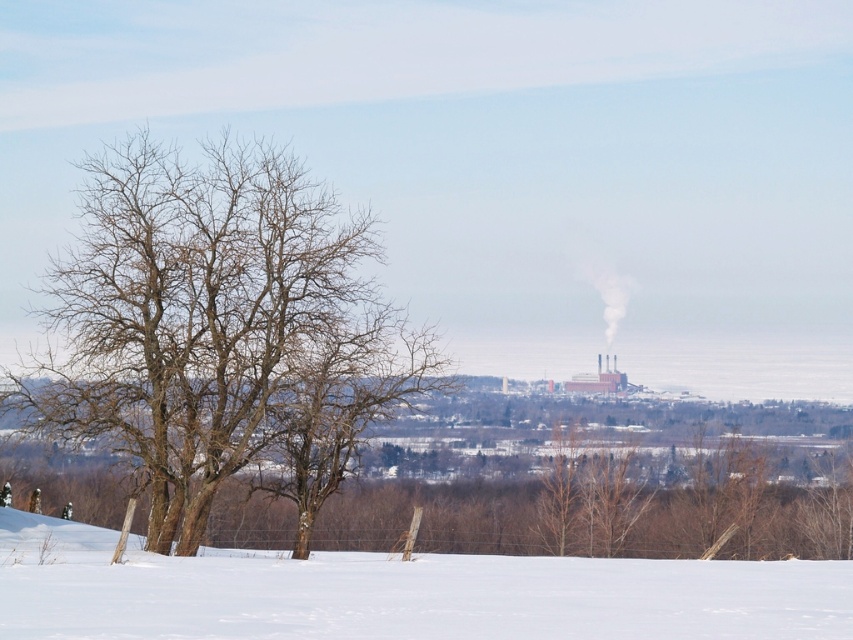
Question: Can you confirm if bare wood tree at left is positioned above white snow at lower center?

Choices:
 (A) yes
 (B) no

Answer: (A)

Question: Which point appears closest to the camera in this image?

Choices:
 (A) (48, 285)
 (B) (180, 630)

Answer: (B)

Question: Can you confirm if bare wood tree at left is wider than white snow at lower center?

Choices:
 (A) yes
 (B) no

Answer: (B)

Question: Which point appears closest to the camera in this image?

Choices:
 (A) (223, 276)
 (B) (178, 580)

Answer: (B)

Question: Can you confirm if bare wood tree at left is positioned above white snow at lower center?

Choices:
 (A) no
 (B) yes

Answer: (B)